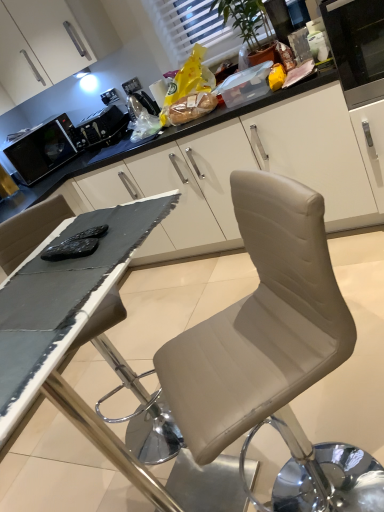
Question: From the image's perspective, is satin black toaster at upper center, the 1th appliance from the right, below black matte table at center?

Choices:
 (A) yes
 (B) no

Answer: (B)

Question: Considering the relative positions of satin black toaster at upper center, the 1th appliance from the right, and black matte table at center in the image provided, is satin black toaster at upper center, the 1th appliance from the right, to the left of black matte table at center from the viewer's perspective?

Choices:
 (A) yes
 (B) no

Answer: (A)

Question: Is satin black toaster at upper center, the 1th appliance from the right, completely or partially outside of black matte table at center?

Choices:
 (A) no
 (B) yes

Answer: (B)

Question: Does satin black toaster at upper center, the 2th appliance viewed from the left, have a lesser height compared to black matte table at center?

Choices:
 (A) no
 (B) yes

Answer: (A)

Question: From a real-world perspective, is satin black toaster at upper center, the 1th appliance from the right, positioned under black matte table at center based on gravity?

Choices:
 (A) no
 (B) yes

Answer: (B)

Question: In the image, is matte plastic bag of bread at upper center positioned in front of or behind beige leather chair at center?

Choices:
 (A) front
 (B) behind

Answer: (B)

Question: From a real-world perspective, relative to beige leather chair at center, is matte plastic bag of bread at upper center vertically above or below?

Choices:
 (A) below
 (B) above

Answer: (B)

Question: Is matte plastic bag of bread at upper center taller or shorter than beige leather chair at center?

Choices:
 (A) short
 (B) tall

Answer: (B)

Question: From the image's perspective, is matte plastic bag of bread at upper center above or below beige leather chair at center?

Choices:
 (A) below
 (B) above

Answer: (B)

Question: From a real-world perspective, relative to white textured window at upper center, is beige leather chair at center vertically above or below?

Choices:
 (A) above
 (B) below

Answer: (B)

Question: Considering the positions of beige leather chair at center and white textured window at upper center in the image, is beige leather chair at center bigger or smaller than white textured window at upper center?

Choices:
 (A) small
 (B) big

Answer: (B)

Question: Is beige leather chair at center wider or thinner than white textured window at upper center?

Choices:
 (A) thin
 (B) wide

Answer: (B)

Question: Is beige leather chair at center taller or shorter than white textured window at upper center?

Choices:
 (A) short
 (B) tall

Answer: (A)

Question: Do you think black matte microwave at left, which is the 1th appliance in left-to-right order, is within white textured window at upper center, or outside of it?

Choices:
 (A) inside
 (B) outside

Answer: (B)

Question: From their relative heights in the image, would you say black matte microwave at left, the second appliance when ordered from right to left, is taller or shorter than white textured window at upper center?

Choices:
 (A) short
 (B) tall

Answer: (A)